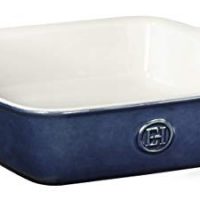
Where is `table`? The height and width of the screenshot is (200, 200). table is located at coordinates (136, 190).